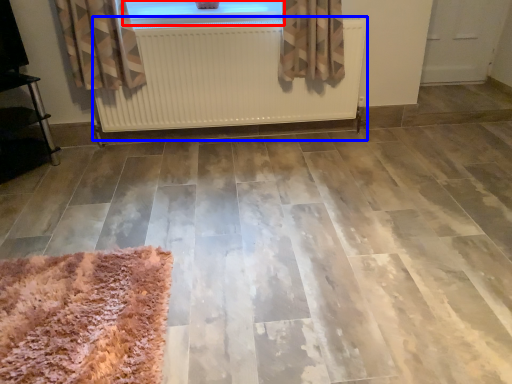
Question: Which of the following is the farthest to the observer, window (highlighted by a red box) or radiator (highlighted by a blue box)?

Choices:
 (A) window
 (B) radiator

Answer: (A)